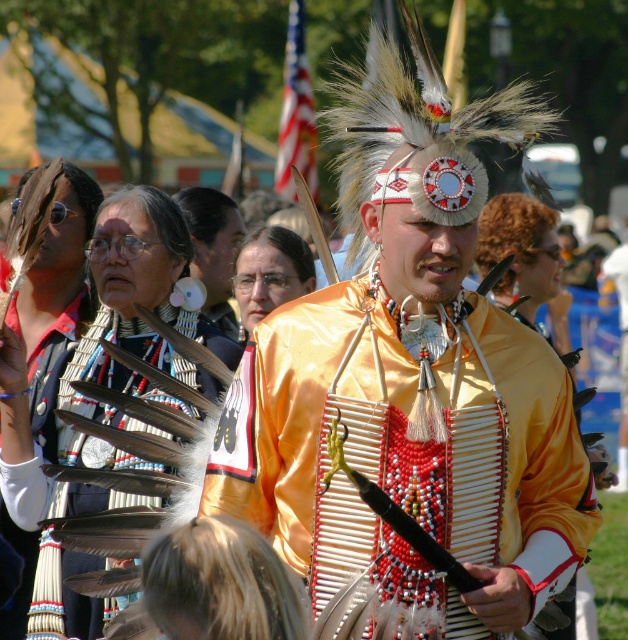
Question: Which point is farther from the camera taking this photo?

Choices:
 (A) (51, 502)
 (B) (77, 321)
 (C) (404, 438)

Answer: (B)

Question: Is feathered vest at center behind feathered headdress at upper center?

Choices:
 (A) yes
 (B) no

Answer: (B)

Question: Which object is farther from the camera taking this photo?

Choices:
 (A) matte black feather at center
 (B) feathered vest at center
 (C) satin yellow vest at center
 (D) feathered headdress at upper center

Answer: (A)

Question: Considering the relative positions of satin yellow vest at center and feathered vest at center in the image provided, where is satin yellow vest at center located with respect to feathered vest at center?

Choices:
 (A) right
 (B) left

Answer: (A)

Question: Which point is closer to the camera taking this photo?

Choices:
 (A) (180, 198)
 (B) (33, 436)
 (C) (176, 310)
 (D) (376, 422)

Answer: (D)

Question: Does satin yellow vest at center have a lesser width compared to feathered vest at center?

Choices:
 (A) no
 (B) yes

Answer: (A)